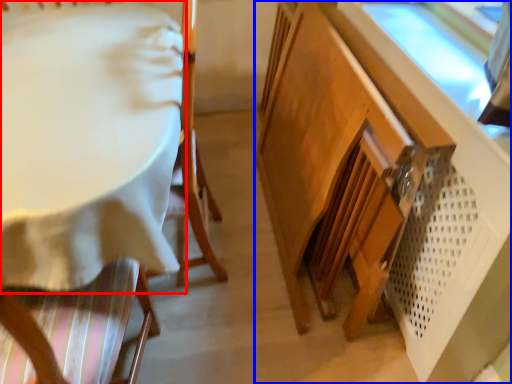
Question: Which point is closer to the camera, table (highlighted by a red box) or cabinetry (highlighted by a blue box)?

Choices:
 (A) table
 (B) cabinetry

Answer: (B)